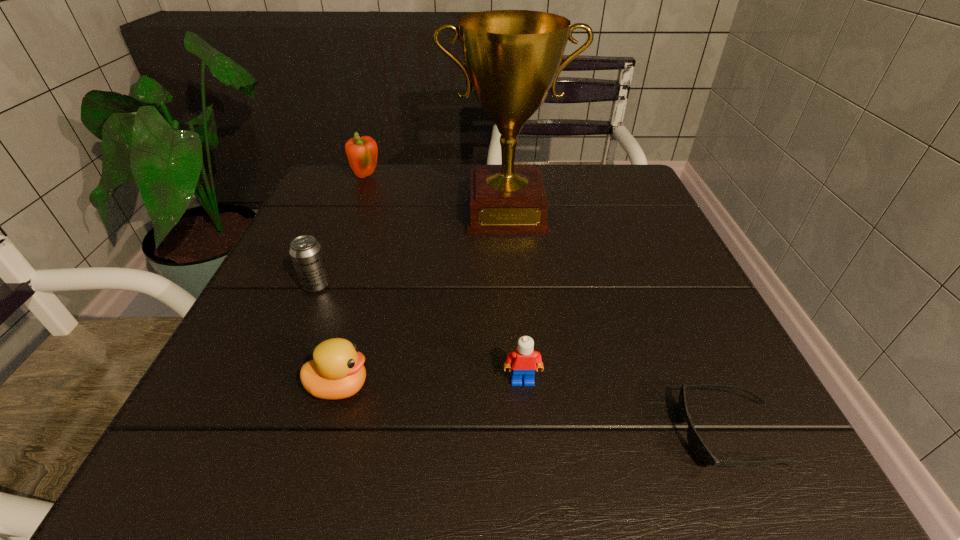
Identify the location of vacant space positioned 0.330m on the right of the pepper. (509, 178).

This screenshot has width=960, height=540. What are the coordinates of `free spot located on the front of the third farthest object` in the screenshot? It's located at (300, 322).

Image resolution: width=960 pixels, height=540 pixels. Find the location of `vacant space located on the face of the duckling`. vacant space located on the face of the duckling is located at coordinates (506, 387).

Where is `vacant position located on the front-facing side of the rightmost object`? The width and height of the screenshot is (960, 540). vacant position located on the front-facing side of the rightmost object is located at coordinates (403, 434).

Identify the location of vacant point located 0.150m on the front-facing side of the rightmost object. This screenshot has width=960, height=540. (571, 434).

I want to click on vacant space located 0.370m on the front-facing side of the rightmost object, so click(x=410, y=434).

Identify the location of award that is at the far edge. (x=512, y=57).

Where is `pepper that is positioned at the far edge`? The width and height of the screenshot is (960, 540). pepper that is positioned at the far edge is located at coordinates (362, 152).

Find the location of a particular element. object located at the near edge is located at coordinates (701, 452).

Find the location of a particular element. pepper that is at the left edge is located at coordinates (362, 152).